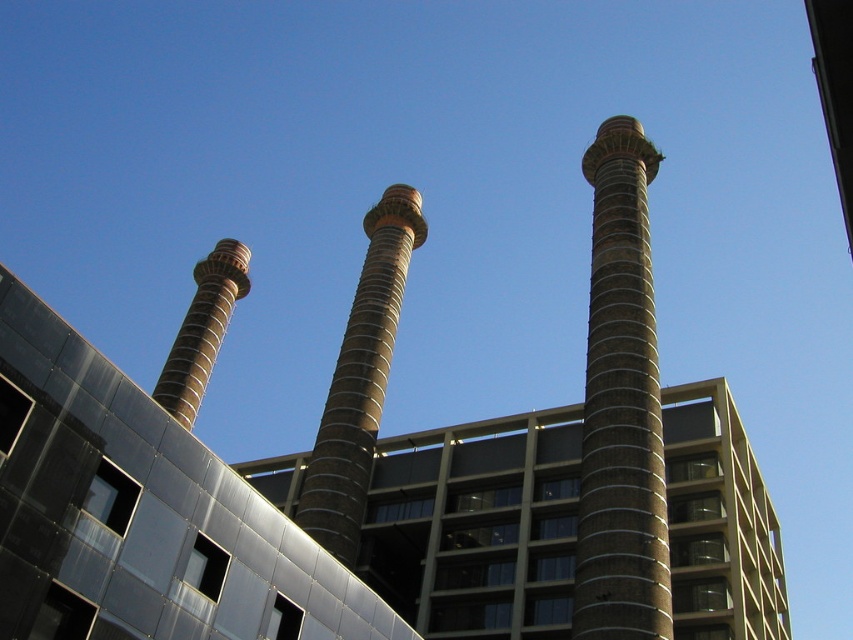
Question: In this image, where is brown textured tower at center located relative to brown textured chimney at left?

Choices:
 (A) below
 (B) above

Answer: (A)

Question: Where is brown concrete pillar at right located in relation to brown textured tower at center in the image?

Choices:
 (A) above
 (B) below

Answer: (A)

Question: Which object is the farthest from the brown textured chimney at left?

Choices:
 (A) brown concrete pillar at right
 (B) brown textured tower at center

Answer: (A)

Question: Can you confirm if brown concrete pillar at right is smaller than brown textured chimney at left?

Choices:
 (A) yes
 (B) no

Answer: (B)

Question: Which object is positioned closest to the brown concrete pillar at right?

Choices:
 (A) brown textured chimney at left
 (B) brown textured tower at center

Answer: (B)

Question: Among these points, which one is farthest from the camera?

Choices:
 (A) (219, 289)
 (B) (613, 548)
 (C) (399, 301)

Answer: (A)